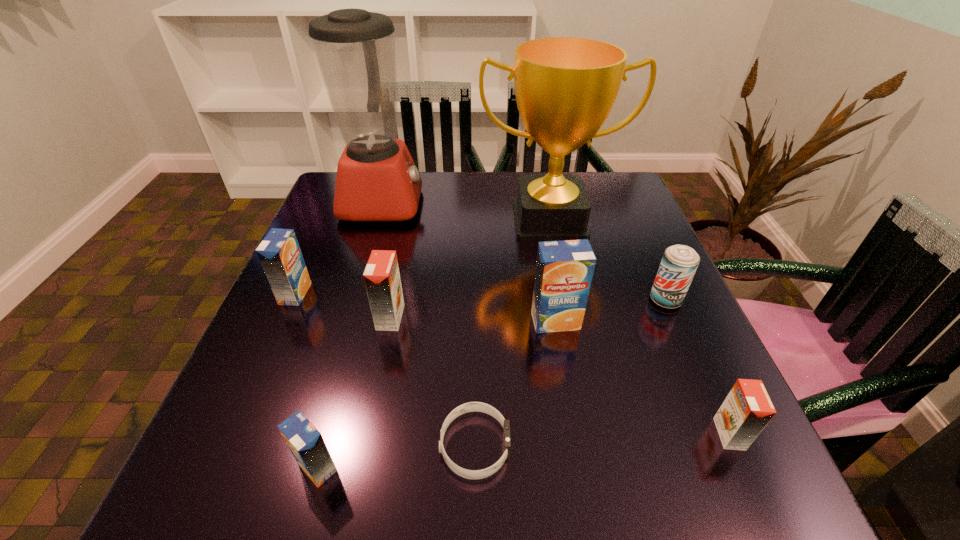
What are the coordinates of `free point located 0.120m on the back of the fourth orange juice from right to left` in the screenshot? It's located at (341, 382).

The image size is (960, 540). In order to click on vacant point located 0.070m on the front of the smaller orange orange juice in this screenshot , I will do `click(758, 498)`.

The width and height of the screenshot is (960, 540). I want to click on free region located on the outer surface of the wristband, so click(606, 446).

The width and height of the screenshot is (960, 540). Identify the location of blender at the far edge. (377, 180).

The image size is (960, 540). What are the coordinates of `award that is at the far edge` in the screenshot? It's located at (565, 87).

Where is `orange_juice at the near edge`? orange_juice at the near edge is located at coordinates (306, 443).

I want to click on wristband at the near edge, so click(x=471, y=406).

At what (x,y) coordinates should I click in order to perform the action: click on blender situated at the left edge. Please return your answer as a coordinate pair (x, y). The height and width of the screenshot is (540, 960). Looking at the image, I should click on (377, 180).

What are the coordinates of `award situated at the right edge` in the screenshot? It's located at (565, 87).

The height and width of the screenshot is (540, 960). Find the location of `beer can located at the right edge`. beer can located at the right edge is located at coordinates coord(679,263).